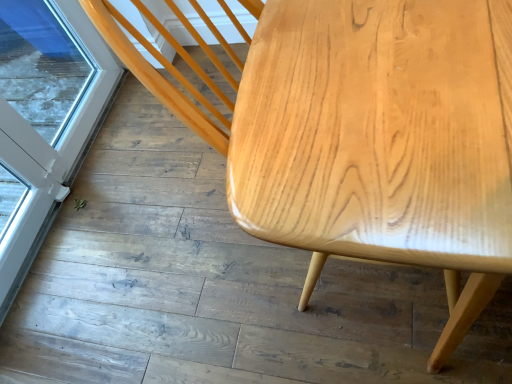
Question: Is light wood table at upper right spatially inside transparent glass screen door at lower left, or outside of it?

Choices:
 (A) outside
 (B) inside

Answer: (A)

Question: Considering their positions, is light wood table at upper right located in front of or behind transparent glass screen door at lower left?

Choices:
 (A) front
 (B) behind

Answer: (A)

Question: From the image's perspective, is light wood table at upper right located above or below transparent glass screen door at lower left?

Choices:
 (A) below
 (B) above

Answer: (A)

Question: Considering their positions, is transparent glass screen door at lower left located in front of or behind light wood table at upper right?

Choices:
 (A) front
 (B) behind

Answer: (B)

Question: Is transparent glass screen door at lower left inside or outside of light wood table at upper right?

Choices:
 (A) outside
 (B) inside

Answer: (A)

Question: From a real-world perspective, is transparent glass screen door at lower left above or below light wood table at upper right?

Choices:
 (A) above
 (B) below

Answer: (A)

Question: Based on their positions, is transparent glass screen door at lower left located to the left or right of light wood table at upper right?

Choices:
 (A) right
 (B) left

Answer: (B)